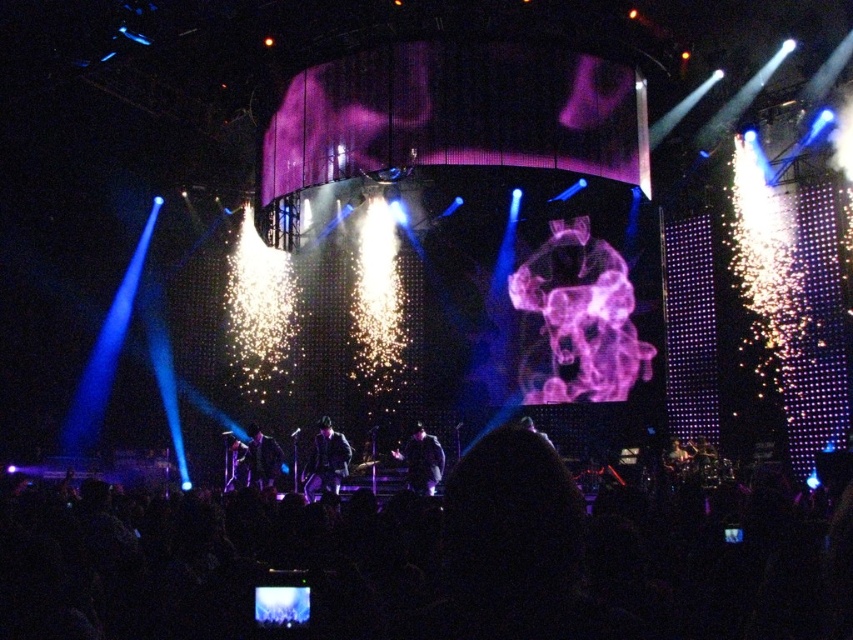
You are a photographer positioned at the front row of the concert. You want to capture a photo of the dark blue fabric jacket at center without any obstructions. Based on the stage layout, is there an unobstructed path from your position to the jacket?

The dark blue fabric jacket at center is located at point (421,460). Since the stage has a clear central area with the large screen and light displays flanking it, there should be an unobstructed path from your front row position to the jacket unless there are other objects not mentioned in the scene description blocking the view.

You are a photographer at the concert and want to capture the point at coordinates point (326, 460). Which object should you focus on to ensure you get the point in your shot?

The point (326, 460) is on the shiny black suit at center, so you should focus on the shiny black suit at center to capture that point.